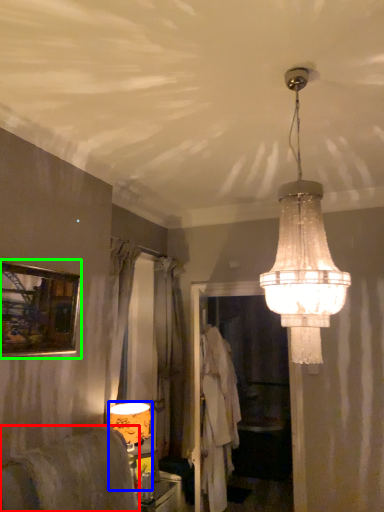
Question: Based on their relative distances, which object is farther from furniture (highlighted by a red box)? Choose from lamp (highlighted by a blue box) and picture frame (highlighted by a green box).

Choices:
 (A) lamp
 (B) picture frame

Answer: (B)